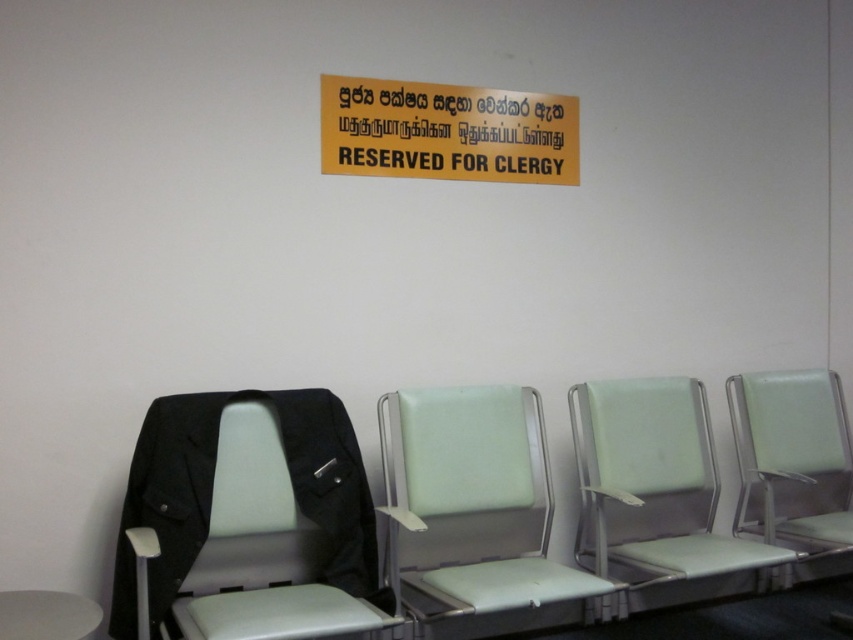
Is matte black chair at left smaller than yellow matte signboard at upper center?

No, matte black chair at left is not smaller than yellow matte signboard at upper center.

Who is positioned more to the right, matte black chair at left or yellow matte signboard at upper center?

yellow matte signboard at upper center is more to the right.

The image size is (853, 640). What are the coordinates of `matte black chair at left` in the screenshot? It's located at (247, 522).

Find the location of `matte black chair at left`. matte black chair at left is located at coordinates 247,522.

Is point (276, 486) positioned after point (631, 456)?

No.

Where is `matte black chair at left`? The width and height of the screenshot is (853, 640). matte black chair at left is located at coordinates (247, 522).

Between point (297, 454) and point (621, 406), which one is positioned in front?

Point (297, 454) is in front.

The height and width of the screenshot is (640, 853). Find the location of `matte black chair at left`. matte black chair at left is located at coordinates (247, 522).

Can you confirm if matte black chair at left is positioned above white plastic stool at lower left?

Correct, matte black chair at left is located above white plastic stool at lower left.

Is matte black chair at left to the left of white plastic stool at lower left from the viewer's perspective?

Incorrect, matte black chair at left is not on the left side of white plastic stool at lower left.

The width and height of the screenshot is (853, 640). What do you see at coordinates (247, 522) in the screenshot? I see `matte black chair at left` at bounding box center [247, 522].

In order to click on matte black chair at left in this screenshot , I will do `click(247, 522)`.